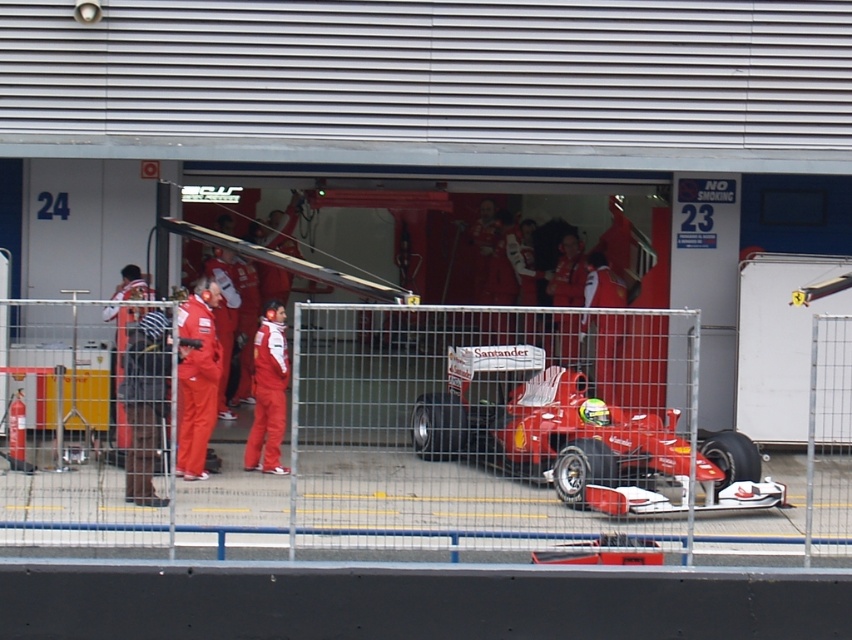
You are a race engineer observing the pit stop area. You notice the metal at center and the shiny red race car at center. Which object is positioned higher relative to the other?

The metal at center is located above the shiny red race car at center, so it is positioned higher.

You are a Formula One pit crew member and need to position a tool box exactly at the midpoint between the shiny red race car at center and the pit lane entrance. Where should you place the tool box?

The tool box should be placed at the midpoint between the shiny red race car at center and the pit lane entrance. However, the exact coordinates or distance to the pit lane entrance are not provided in the scene description, so precise placement isn not possible with the given information.

You are a race engineer standing at the camera position. You need to place a safety barrier at point (586, 456). The safety barrier requires a minimum of 10 meters of space in front of it to function properly. Is the available space sufficient?

The point (586, 456) is 15.91 meters from the camera, which means there is sufficient space as it exceeds the required 10 meters. Therefore, the safety barrier can be placed there.